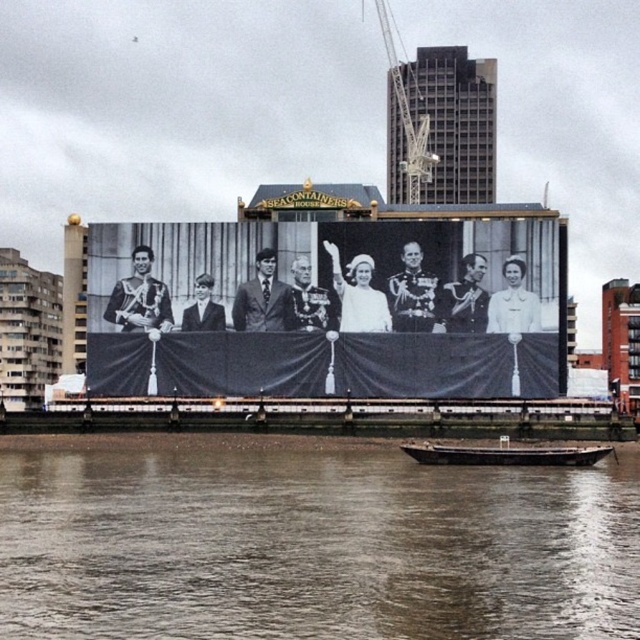
Question: Which object is closer to the camera taking this photo?

Choices:
 (A) black and white photograph at center
 (B) rusty metal barge at lower center
 (C) brown water at lower center
 (D) metallic gray crane at upper center

Answer: (C)

Question: Does brown water at lower center appear on the right side of rusty metal barge at lower center?

Choices:
 (A) no
 (B) yes

Answer: (A)

Question: Which point is closer to the camera taking this photo?

Choices:
 (A) (412, 177)
 (B) (323, 371)
 (C) (387, 464)
 (D) (499, 444)

Answer: (C)

Question: Which object appears closest to the camera in this image?

Choices:
 (A) rusty metal barge at lower center
 (B) metallic gray crane at upper center
 (C) black and white photograph at center

Answer: (A)

Question: Is brown water at lower center thinner than metallic gray crane at upper center?

Choices:
 (A) no
 (B) yes

Answer: (A)

Question: Does black and white photograph at center appear over metallic gray crane at upper center?

Choices:
 (A) yes
 (B) no

Answer: (B)